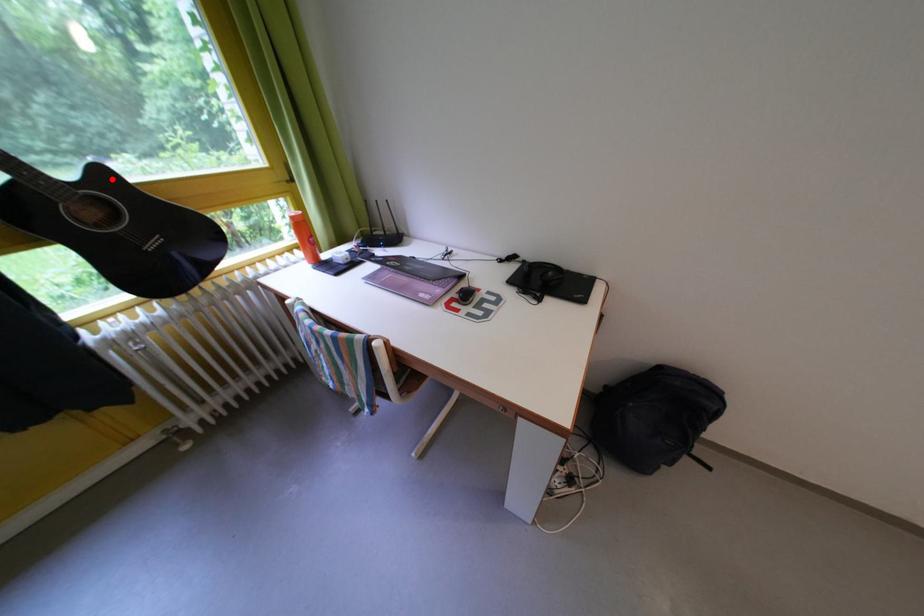
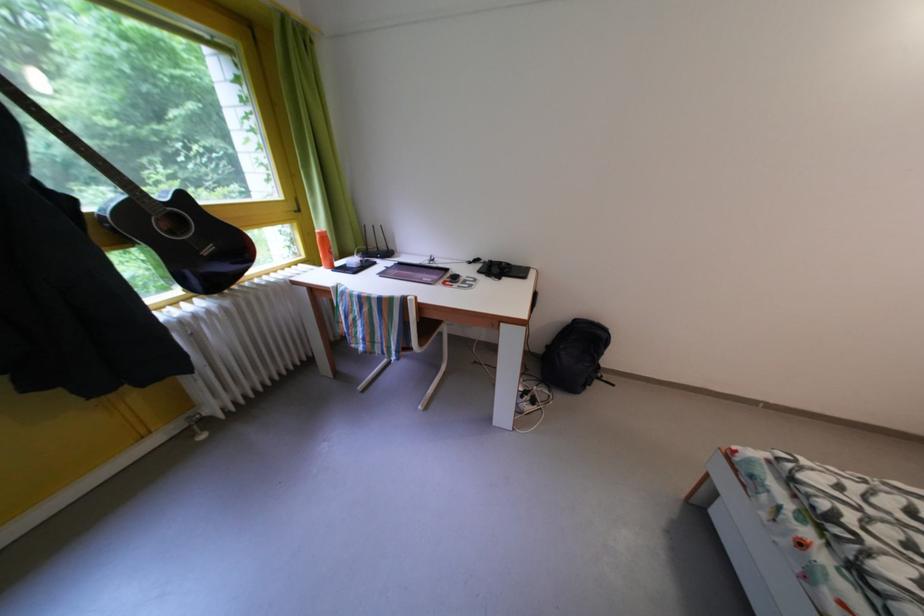
Question: I am providing you with two images of the same scene from different viewpoints. In image1, a red point is highlighted. Considering the same 3D point in image2, which of the following is correct?

Choices:
 (A) It is closer
 (B) It is farther

Answer: (B)